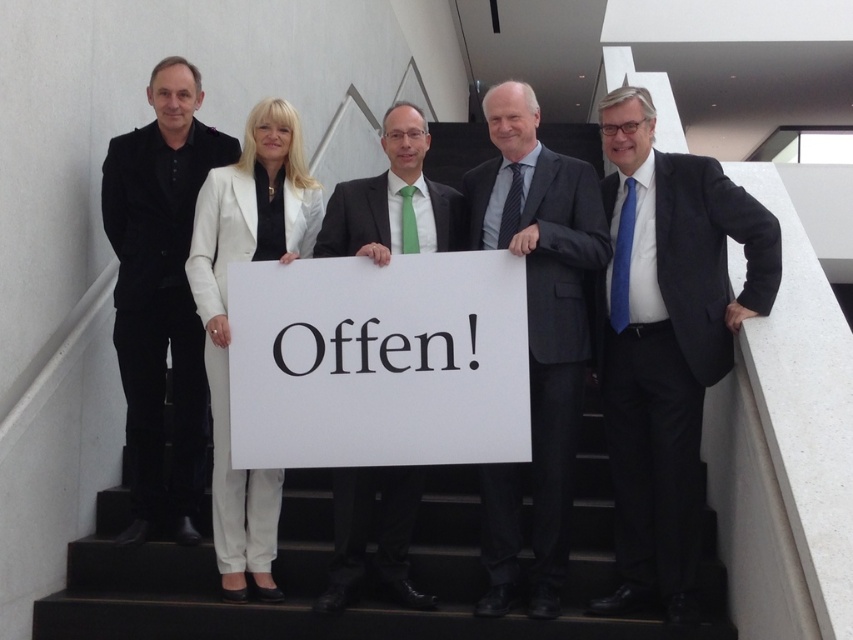
Question: Does black matte suit at left appear on the left side of white smooth suit at center?

Choices:
 (A) no
 (B) yes

Answer: (B)

Question: Which of these objects is positioned farthest from the matte black suit at center?

Choices:
 (A) white smooth suit at center
 (B) black matte suit at left
 (C) dark gray suit at center

Answer: (B)

Question: Which point is farther to the camera?

Choices:
 (A) white smooth suit at center
 (B) green silk tie at center
 (C) blue silk tie at right

Answer: (A)

Question: Does black matte suit at left appear on the left side of dark gray suit at center?

Choices:
 (A) yes
 (B) no

Answer: (A)

Question: Which point is farther from the camera taking this photo?

Choices:
 (A) (674, 292)
 (B) (490, 224)

Answer: (B)

Question: Where is matte black suit at center located in relation to black matte suit at left in the image?

Choices:
 (A) left
 (B) right

Answer: (B)